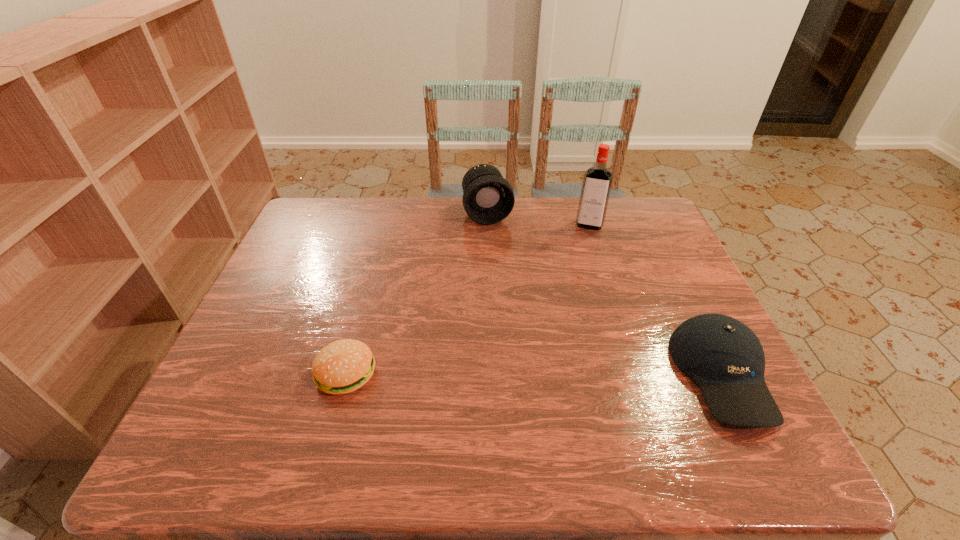
Image resolution: width=960 pixels, height=540 pixels. I want to click on the shortest object, so click(x=343, y=366).

The image size is (960, 540). Find the location of `the leftmost object`. the leftmost object is located at coordinates (343, 366).

What are the coordinates of `the second shortest object` in the screenshot? It's located at (724, 357).

What are the coordinates of `baseball cap` in the screenshot? It's located at (724, 357).

This screenshot has width=960, height=540. Identify the location of vodka. 597,181.

You are a GUI agent. You are given a task and a screenshot of the screen. Output one action in this format:
    pyautogui.click(x=<x>, y=<y>)
    Task: Click on the third object from left to right
    The height and width of the screenshot is (540, 960).
    Given the screenshot: What is the action you would take?
    pyautogui.click(x=597, y=181)

Where is `the second object from left to right`? The image size is (960, 540). the second object from left to right is located at coordinates (488, 198).

Find the location of a particular element. The image size is (960, 540). telephoto lens is located at coordinates (488, 198).

Where is `vacant area located 0.240m on the back of the shortest object`? The height and width of the screenshot is (540, 960). vacant area located 0.240m on the back of the shortest object is located at coordinates (372, 279).

What are the coordinates of `vacant space located 0.240m on the front and back of the tallest object` in the screenshot? It's located at [576, 282].